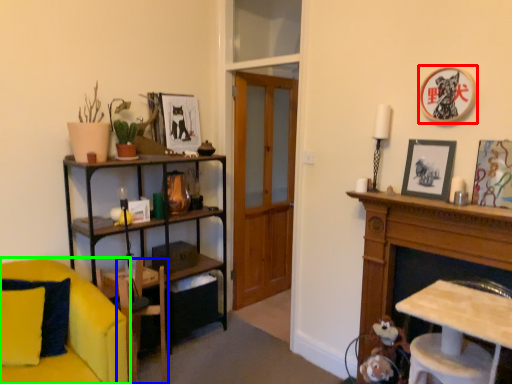
Question: Which object is the closest to the picture frame (highlighted by a red box)? Choose among these: armchair (highlighted by a blue box) or chair (highlighted by a green box).

Choices:
 (A) armchair
 (B) chair

Answer: (A)